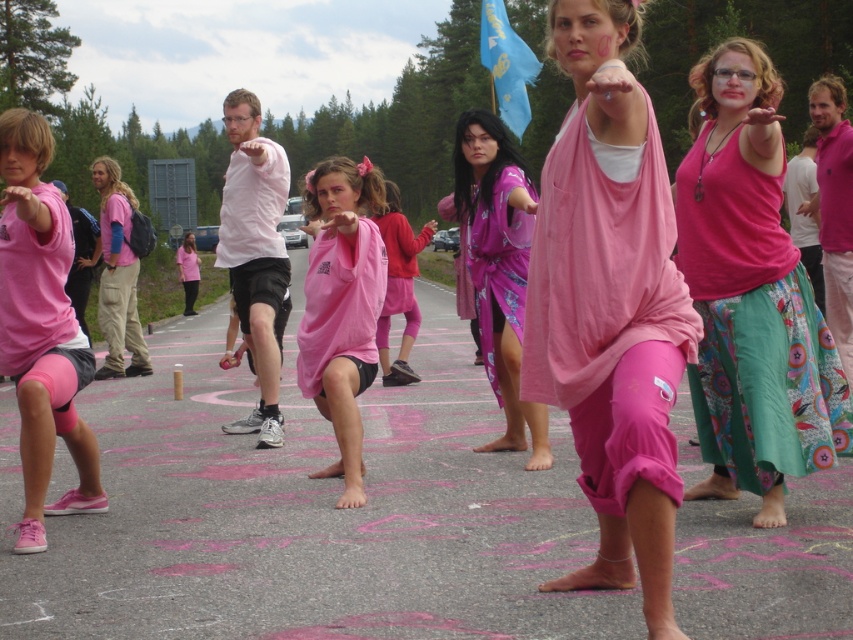
Is point (338, 198) closer to camera compared to point (482, 266)?

Yes, point (338, 198) is in front of point (482, 266).

Between matte pink shirt at center and pink fabric robe at center, which one has more height?

With more height is pink fabric robe at center.

What do you see at coordinates (341, 307) in the screenshot? This screenshot has width=853, height=640. I see `matte pink shirt at center` at bounding box center [341, 307].

Identify the location of matte pink shirt at center. This screenshot has width=853, height=640. (341, 307).

Is pink fabric at center shorter than matte pink shirt at center?

No, pink fabric at center is not shorter than matte pink shirt at center.

Between pink fabric at center and matte pink shirt at center, which one has less height?

matte pink shirt at center is shorter.

Describe the element at coordinates (610, 307) in the screenshot. I see `pink fabric at center` at that location.

At what (x,y) coordinates should I click in order to perform the action: click on pink fabric at center. Please return your answer as a coordinate pair (x, y). Looking at the image, I should click on (610, 307).

Who is more distant from viewer, (749, 488) or (393, 208)?

Point (393, 208)

Does pink fabric skirt at center appear on the right side of pink fabric dress at center?

Yes, pink fabric skirt at center is to the right of pink fabric dress at center.

This screenshot has height=640, width=853. What are the coordinates of `pink fabric skirt at center` in the screenshot? It's located at (751, 296).

At what (x,y) coordinates should I click in order to perform the action: click on pink fabric skirt at center. Please return your answer as a coordinate pair (x, y). Looking at the image, I should click on (751, 296).